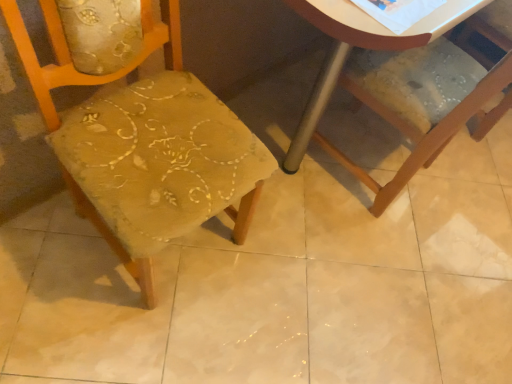
At what (x,y) coordinates should I click in order to perform the action: click on spots to the right of wooden chair at lower right, which is counted as the 1th chair, starting from the right. Please return your answer as a coordinate pair (x, y). Looking at the image, I should click on [x=464, y=209].